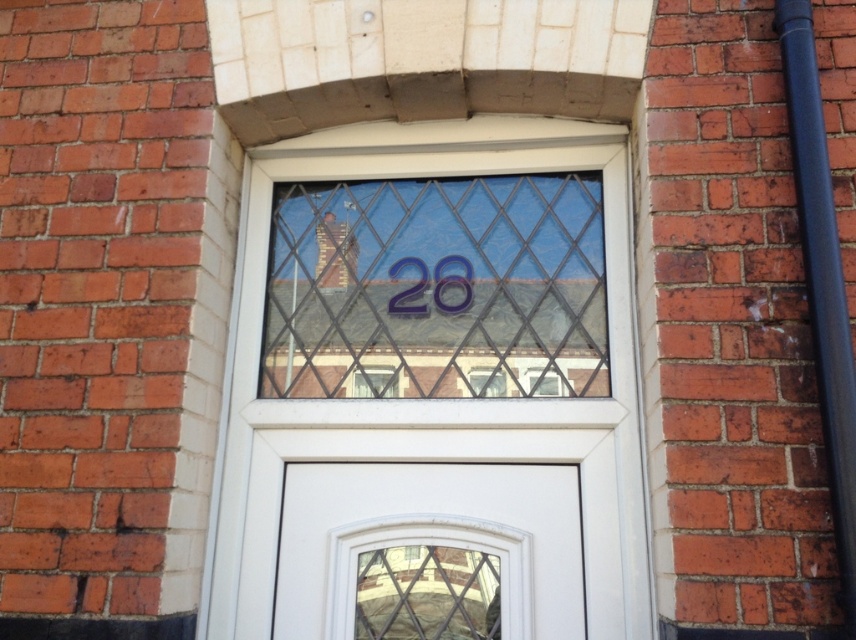
You are a delivery driver who needs to locate apartment number 28. You see the white glossy door at center and the matte plastic number at center. Which object should you look at to find the correct apartment number?

The matte plastic number at center displays the apartment number 28, so you should look at the matte plastic number at center to find the correct apartment number.

You are an architect designing a new building facade and want to ensure proper visibility through the transparent glass at center while maintaining the visibility of the matte plastic number at center. Based on the scene, which object is taller and would allow more light to pass through?

The transparent glass at center has a greater height compared to the matte plastic number at center, so it would allow more light to pass through while still maintaining the visibility of the number.